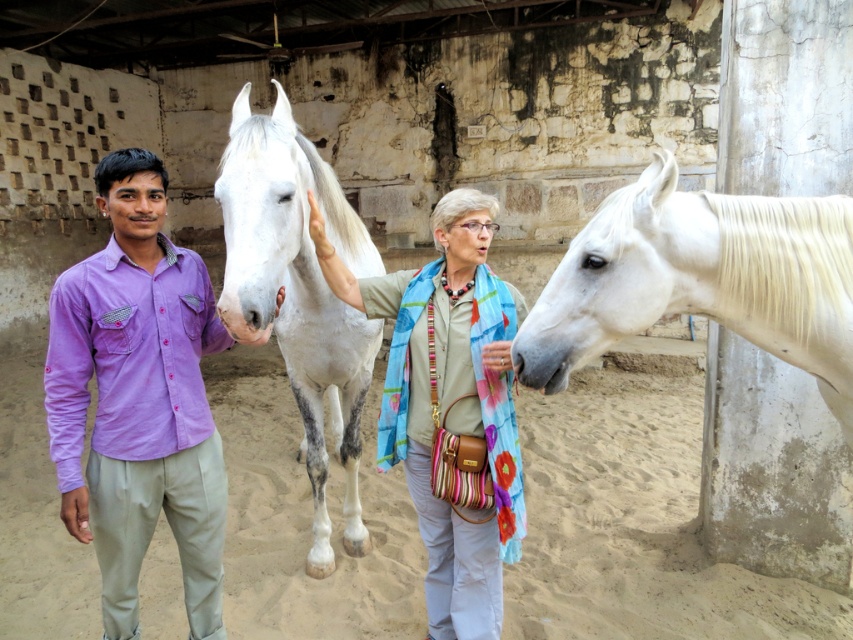
You are a photographer trying to capture a photo of the white speckled fur at center and the purple cotton shirt at left. Based on their positions, which one should you focus on first if you want to include both in your frame without moving the camera?

The purple cotton shirt at left is to the left of white speckled fur at center, so you should focus on the purple cotton shirt at left first to ensure both are in frame without moving the camera.

You are standing in the stable and want to place a new hay bale at point (216,513). If your arm reaches 2 meters, can you reach that point?

The distance of point (216,513) from viewer is 2.37 meters, so no, you cannot reach that point since it is farther than your arm can reach.

In the scene shown: You are a photographer trying to capture a photo of the white glossy horse at right and the light beige scarf at center. If you want to ensure both subjects are fully visible in the frame without cropping, which object should you position closer to the camera?

The white glossy horse at right might be wider than the light beige scarf at center, so you should position the white glossy horse at right closer to the camera to ensure it fits within the frame.